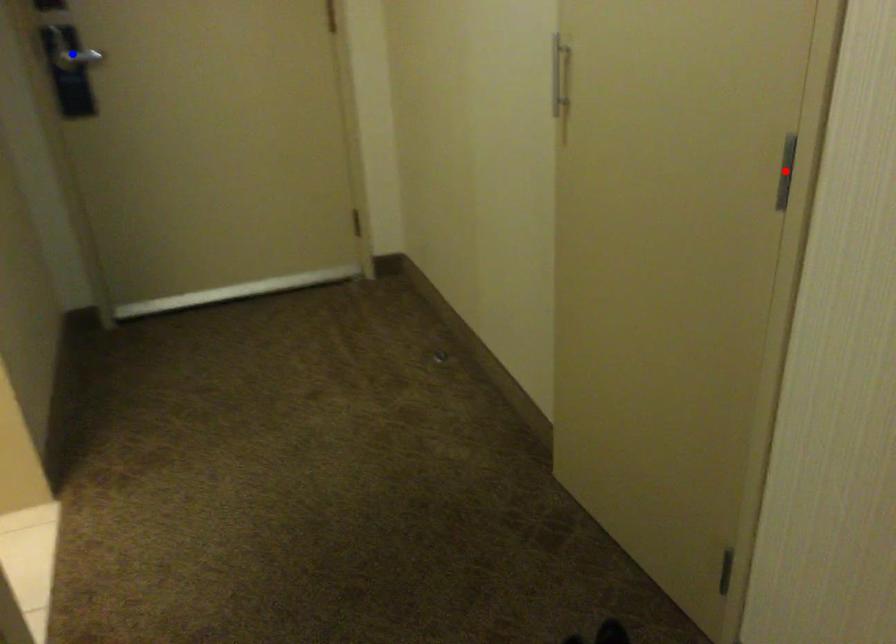
Question: Two points are marked on the image. Which point is closer to the camera?

Choices:
 (A) Blue point is closer.
 (B) Red point is closer.

Answer: (B)